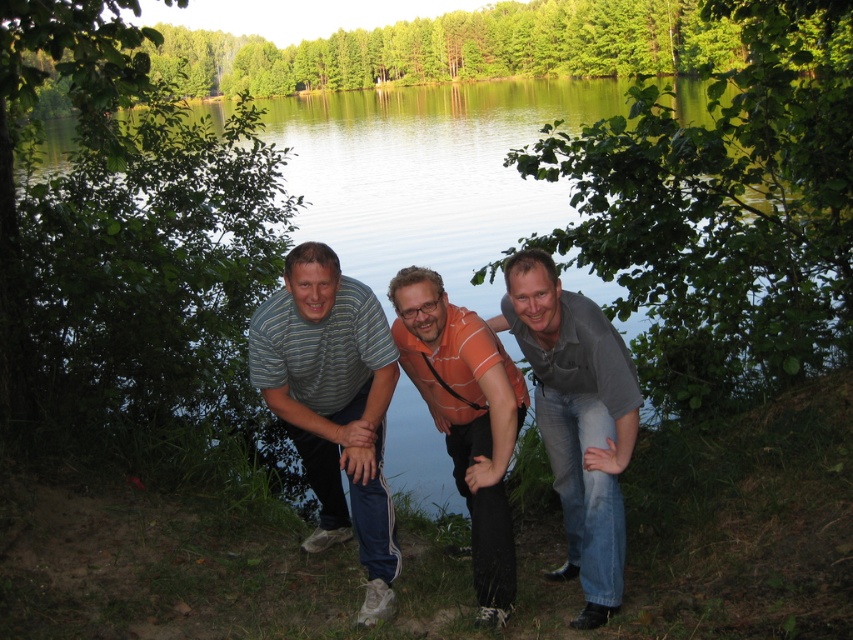
Which is more to the right, green water at center or orange striped shirt at center?

Positioned to the right is orange striped shirt at center.

I want to click on green water at center, so click(x=546, y=212).

Locate an element on the screen. The height and width of the screenshot is (640, 853). green water at center is located at coordinates (546, 212).

Where is `green water at center`? The width and height of the screenshot is (853, 640). green water at center is located at coordinates (546, 212).

Who is more forward, (578, 328) or (474, 465)?

Point (578, 328)

This screenshot has height=640, width=853. Identify the location of gray matte shirt at center. (577, 419).

What are the coordinates of `gray matte shirt at center` in the screenshot? It's located at (577, 419).

The height and width of the screenshot is (640, 853). What are the coordinates of `gray matte shirt at center` in the screenshot? It's located at pyautogui.click(x=577, y=419).

Can you confirm if striped cotton shirt at center is thinner than gray matte shirt at center?

In fact, striped cotton shirt at center might be wider than gray matte shirt at center.

Does point (329, 513) come behind point (592, 328)?

Yes, point (329, 513) is farther from viewer.

Between point (270, 308) and point (585, 524), which one is positioned in front?

Point (585, 524) is in front.

You are a GUI agent. You are given a task and a screenshot of the screen. Output one action in this format:
    pyautogui.click(x=<x>, y=<y>)
    Task: Click on the striped cotton shirt at center
    This screenshot has height=640, width=853.
    Given the screenshot: What is the action you would take?
    pyautogui.click(x=334, y=403)